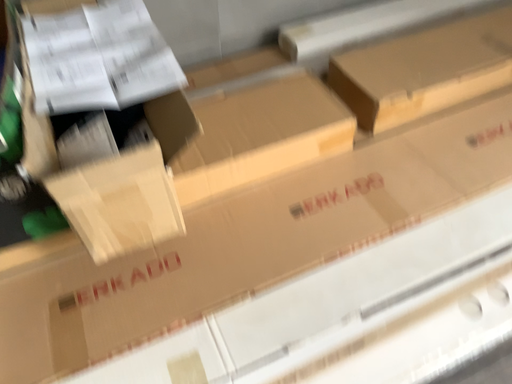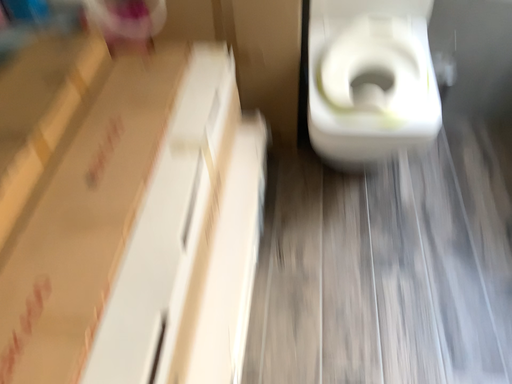
Question: How did the camera likely rotate when shooting the video?

Choices:
 (A) rotated right
 (B) rotated left

Answer: (A)